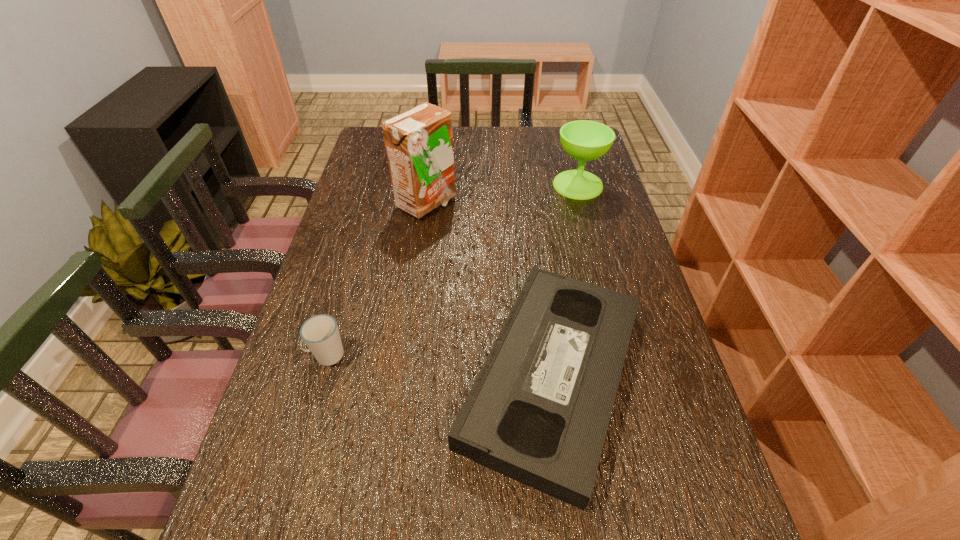
Image resolution: width=960 pixels, height=540 pixels. I want to click on the third object from right to left, so click(x=419, y=142).

Locate an element on the screen. This screenshot has width=960, height=540. the tallest object is located at coordinates (419, 142).

This screenshot has height=540, width=960. I want to click on the second tallest object, so click(583, 140).

Image resolution: width=960 pixels, height=540 pixels. Find the location of `cup`. cup is located at coordinates (320, 333).

I want to click on the leftmost object, so click(320, 333).

Where is `the shortest object`? Image resolution: width=960 pixels, height=540 pixels. the shortest object is located at coordinates (538, 412).

Locate an element on the screen. Image resolution: width=960 pixels, height=540 pixels. vacant space located on the straw side of the carton is located at coordinates (554, 204).

At what (x,y) coordinates should I click in order to perform the action: click on free space located on the left of the wineglass. Please return your answer as a coordinate pair (x, y). Looking at the image, I should click on tap(526, 185).

Find the location of `free space located 0.150m on the back of the videotape`. free space located 0.150m on the back of the videotape is located at coordinates (536, 245).

Locate an element on the screen. object that is at the left edge is located at coordinates (320, 333).